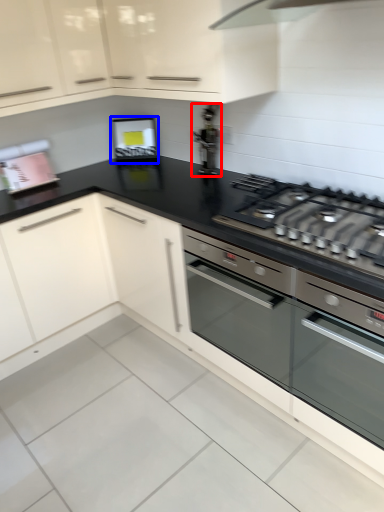
Question: Among these objects, which one is farthest to the camera, appliance (highlighted by a red box) or appliance (highlighted by a blue box)?

Choices:
 (A) appliance
 (B) appliance

Answer: (B)